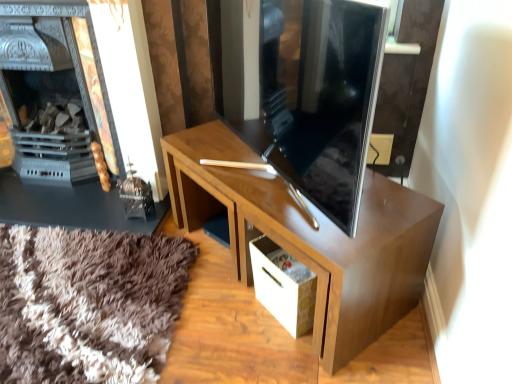
Question: Does matte black fireplace at left touch white cardboard drawer at lower center?

Choices:
 (A) no
 (B) yes

Answer: (A)

Question: Is matte black fireplace at left positioned beyond the bounds of white cardboard drawer at lower center?

Choices:
 (A) yes
 (B) no

Answer: (A)

Question: Would you consider matte black fireplace at left to be distant from white cardboard drawer at lower center?

Choices:
 (A) no
 (B) yes

Answer: (B)

Question: Does matte black fireplace at left have a lesser width compared to white cardboard drawer at lower center?

Choices:
 (A) no
 (B) yes

Answer: (A)

Question: From a real-world perspective, does matte black fireplace at left sit lower than white cardboard drawer at lower center?

Choices:
 (A) no
 (B) yes

Answer: (A)

Question: In terms of height, does glossy wood desk at center look taller or shorter compared to matte black fireplace at left?

Choices:
 (A) short
 (B) tall

Answer: (A)

Question: Considering the positions of point (377, 317) and point (14, 115), is point (377, 317) closer or farther from the camera than point (14, 115)?

Choices:
 (A) closer
 (B) farther

Answer: (A)

Question: Considering their positions, is glossy wood desk at center located in front of or behind matte black fireplace at left?

Choices:
 (A) behind
 (B) front

Answer: (B)

Question: Considering the relative positions of glossy wood desk at center and matte black fireplace at left in the image provided, is glossy wood desk at center to the left or to the right of matte black fireplace at left?

Choices:
 (A) left
 (B) right

Answer: (B)

Question: From a real-world perspective, is glossy wood desk at center positioned above or below white cardboard drawer at lower center?

Choices:
 (A) below
 (B) above

Answer: (B)

Question: In terms of width, does glossy wood desk at center look wider or thinner when compared to white cardboard drawer at lower center?

Choices:
 (A) thin
 (B) wide

Answer: (B)

Question: Is glossy wood desk at center in front of or behind white cardboard drawer at lower center in the image?

Choices:
 (A) front
 (B) behind

Answer: (A)

Question: Is glossy wood desk at center to the left or to the right of white cardboard drawer at lower center in the image?

Choices:
 (A) left
 (B) right

Answer: (A)

Question: Considering the positions of matte black fireplace at left and glossy wood desk at center in the image, is matte black fireplace at left wider or thinner than glossy wood desk at center?

Choices:
 (A) wide
 (B) thin

Answer: (B)

Question: In the image, is matte black fireplace at left on the left side or the right side of glossy wood desk at center?

Choices:
 (A) right
 (B) left

Answer: (B)